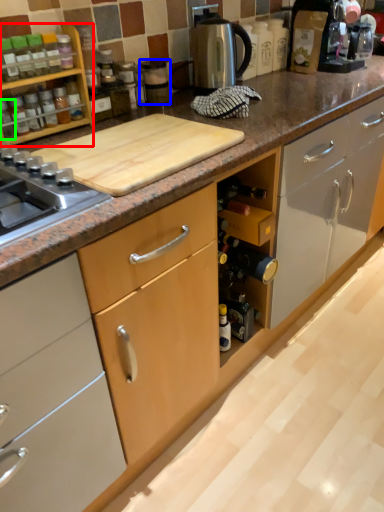
Question: Based on their relative distances, which object is nearer to kitchen appliance (highlighted by a red box)? Choose from appliance (highlighted by a blue box) and bottle (highlighted by a green box).

Choices:
 (A) appliance
 (B) bottle

Answer: (B)